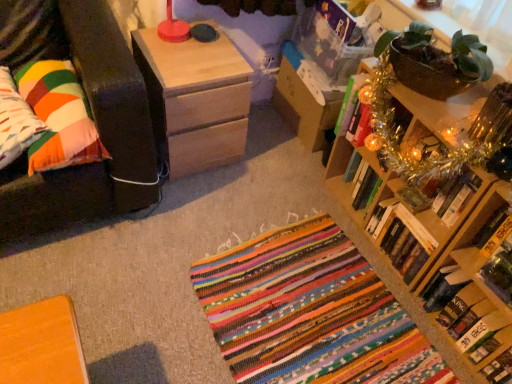
In order to click on empty space that is ontop of multicolored woven rug at center in this screenshot , I will do `click(314, 316)`.